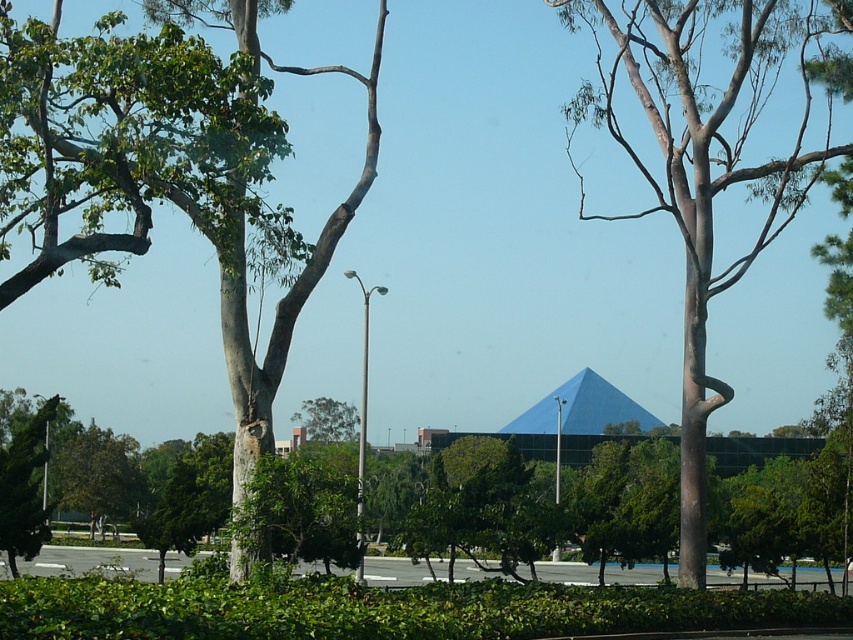
Who is positioned more to the right, green rough bark tree at left or brown textured tree at center?

brown textured tree at center is more to the right.

Which is more to the left, green rough bark tree at left or brown textured tree at center?

Positioned to the left is green rough bark tree at left.

Is point (71, 131) farther from camera compared to point (701, 8)?

That is False.

At what (x,y) coordinates should I click in order to perform the action: click on green rough bark tree at left. Please return your answer as a coordinate pair (x, y). The height and width of the screenshot is (640, 853). Looking at the image, I should click on (166, 164).